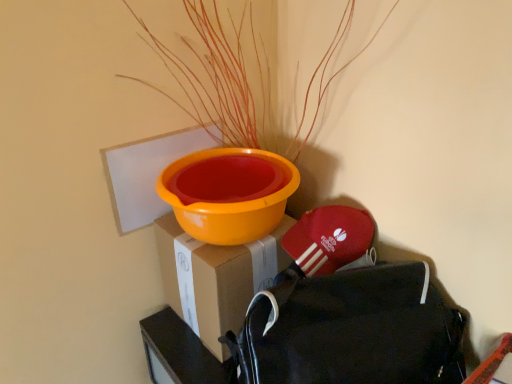
Question: Does cardboard box at center have a larger size compared to black fabric backpack at lower right?

Choices:
 (A) no
 (B) yes

Answer: (A)

Question: From a real-world perspective, is cardboard box at center over black fabric backpack at lower right?

Choices:
 (A) no
 (B) yes

Answer: (A)

Question: Is cardboard box at center turned away from black fabric backpack at lower right?

Choices:
 (A) yes
 (B) no

Answer: (B)

Question: Does cardboard box at center have a greater width compared to black fabric backpack at lower right?

Choices:
 (A) yes
 (B) no

Answer: (A)

Question: Is cardboard box at center aimed at black fabric backpack at lower right?

Choices:
 (A) yes
 (B) no

Answer: (B)

Question: Is point (262, 238) positioned closer to the camera than point (434, 380)?

Choices:
 (A) farther
 (B) closer

Answer: (A)

Question: In terms of width, does cardboard box at center look wider or thinner when compared to black fabric backpack at lower right?

Choices:
 (A) thin
 (B) wide

Answer: (B)

Question: From the image's perspective, is cardboard box at center above or below black fabric backpack at lower right?

Choices:
 (A) below
 (B) above

Answer: (B)

Question: Is cardboard box at center taller or shorter than black fabric backpack at lower right?

Choices:
 (A) tall
 (B) short

Answer: (B)

Question: Is point (179, 284) positioned closer to the camera than point (208, 172)?

Choices:
 (A) farther
 (B) closer

Answer: (B)

Question: From the image's perspective, is cardboard box at center positioned above or below orange matte plant at upper center?

Choices:
 (A) below
 (B) above

Answer: (A)

Question: Do you think cardboard box at center is within orange matte plant at upper center, or outside of it?

Choices:
 (A) outside
 (B) inside

Answer: (A)

Question: Is cardboard box at center wider or thinner than orange matte plant at upper center?

Choices:
 (A) wide
 (B) thin

Answer: (B)

Question: Is orange matte plant at upper center wider or thinner than black fabric backpack at lower right?

Choices:
 (A) thin
 (B) wide

Answer: (B)

Question: From a real-world perspective, relative to black fabric backpack at lower right, is orange matte plant at upper center vertically above or below?

Choices:
 (A) above
 (B) below

Answer: (A)